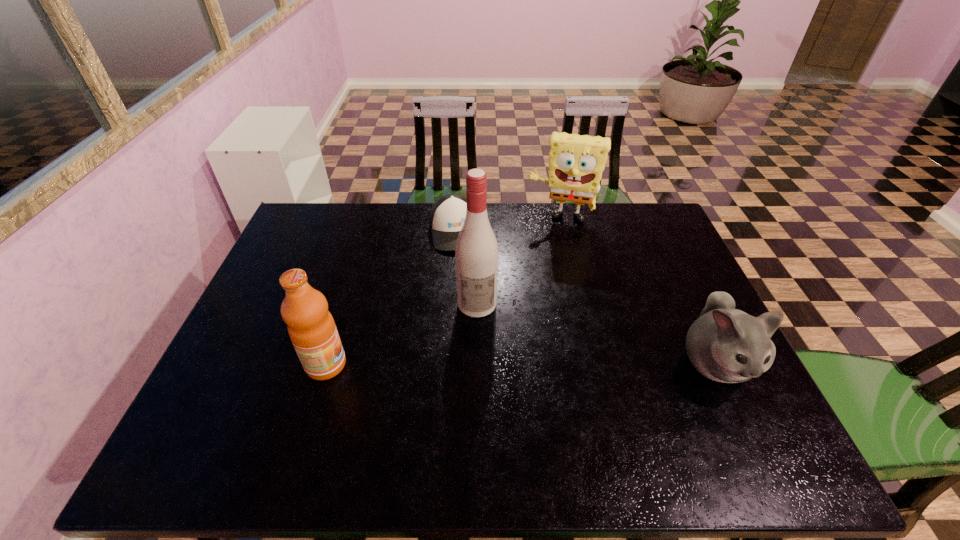
At what (x,y) coordinates should I click in order to perform the action: click on the leftmost object. Please return your answer as a coordinate pair (x, y). Looking at the image, I should click on (311, 327).

Where is `the rightmost object`? The height and width of the screenshot is (540, 960). the rightmost object is located at coordinates (724, 344).

The height and width of the screenshot is (540, 960). In order to click on the second shortest object in this screenshot , I will do `click(724, 344)`.

Locate an element on the screen. Image resolution: width=960 pixels, height=540 pixels. sponge is located at coordinates (576, 163).

Where is `cap`? cap is located at coordinates (448, 213).

Image resolution: width=960 pixels, height=540 pixels. Identify the location of the third farthest object. (476, 252).

The height and width of the screenshot is (540, 960). Find the location of `the tallest object`. the tallest object is located at coordinates 476,252.

The height and width of the screenshot is (540, 960). Find the location of `vacant space located 0.050m on the label side of the fruit juice`. vacant space located 0.050m on the label side of the fruit juice is located at coordinates (367, 365).

Where is `free space located on the face of the sponge`? free space located on the face of the sponge is located at coordinates (547, 261).

At what (x,y) coordinates should I click in order to perform the action: click on vacant space located on the face of the sponge. Please return your answer as a coordinate pair (x, y). The width and height of the screenshot is (960, 540). Looking at the image, I should click on (549, 253).